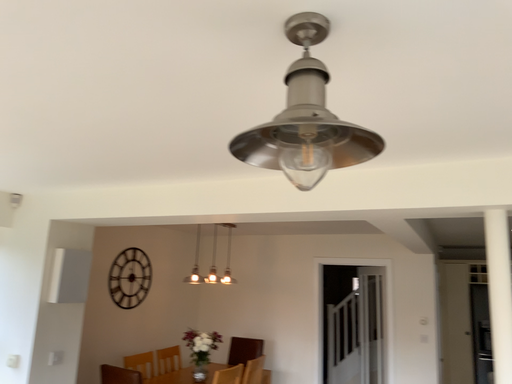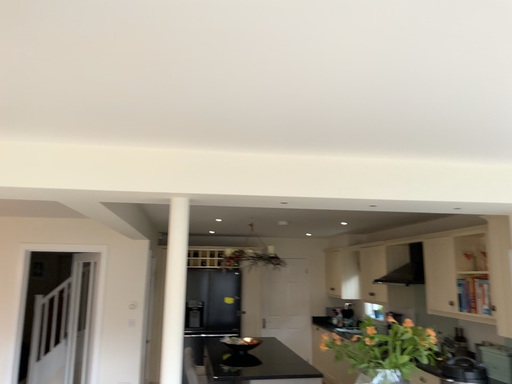
Question: How did the camera likely rotate when shooting the video?

Choices:
 (A) rotated right
 (B) rotated left

Answer: (A)